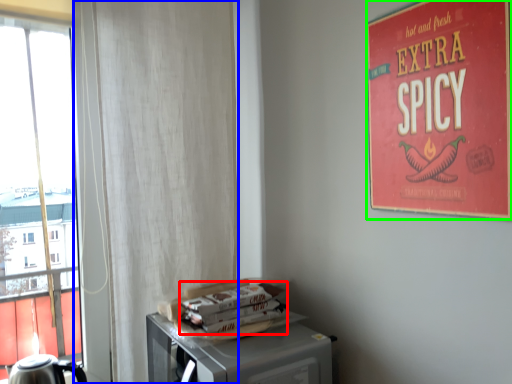
Question: Which is nearer to the magazine (highlighted by a red box)? curtain (highlighted by a blue box) or poster (highlighted by a green box).

Choices:
 (A) curtain
 (B) poster

Answer: (A)